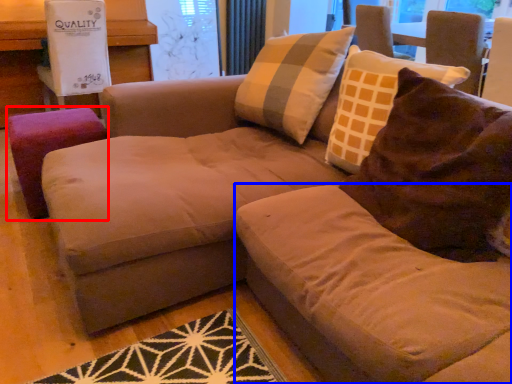
Question: Which object appears closest to the camera in this image, stool (highlighted by a red box) or beige (highlighted by a blue box)?

Choices:
 (A) stool
 (B) beige

Answer: (B)